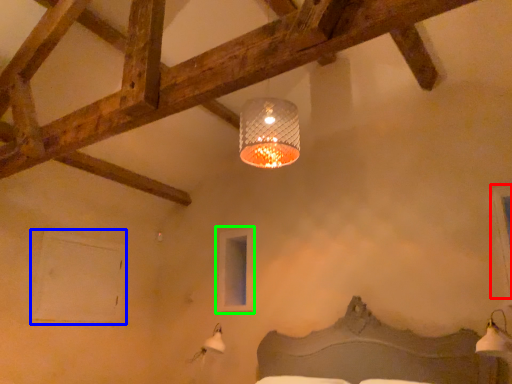
Question: Which object is the farthest from window (highlighted by a red box)? Choose among these: window (highlighted by a blue box) or window (highlighted by a green box).

Choices:
 (A) window
 (B) window

Answer: (A)